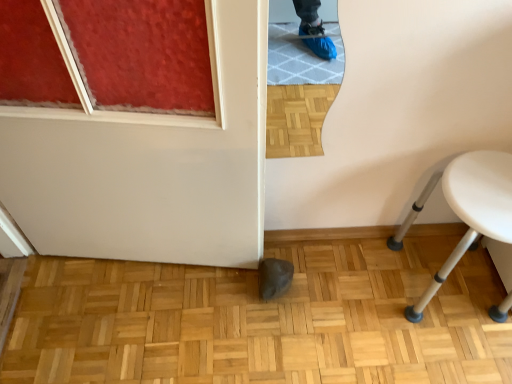
Identify the location of natural wood parquet floor at center. This screenshot has height=384, width=512. (262, 320).

At what (x,y) coordinates should I click in order to perform the action: click on white plastic stool at lower right. Please return your answer as a coordinate pair (x, y). The image size is (512, 384). Looking at the image, I should click on (473, 209).

Does white plastic stool at lower right have a greater width compared to white glossy door at lower center?

Indeed, white plastic stool at lower right has a greater width compared to white glossy door at lower center.

Considering the positions of objects white plastic stool at lower right and white glossy door at lower center in the image provided, who is more to the left, white plastic stool at lower right or white glossy door at lower center?

Positioned to the left is white glossy door at lower center.

Is point (455, 167) positioned before point (250, 11)?

No.

Is white plastic stool at lower right not close to white glossy door at lower center?

No, white plastic stool at lower right is not far away from white glossy door at lower center.

Considering the positions of point (53, 309) and point (57, 151), is point (53, 309) closer or farther from the camera than point (57, 151)?

Point (53, 309) is positioned farther from the camera compared to point (57, 151).

Based on the photo, can you tell me how much natural wood parquet floor at center and white glossy door at lower center differ in facing direction?

The angular difference between natural wood parquet floor at center and white glossy door at lower center is 98.7 degrees.

From the picture: Is natural wood parquet floor at center shorter than white glossy door at lower center?

Yes.

Is natural wood parquet floor at center spatially inside white glossy door at lower center, or outside of it?

natural wood parquet floor at center is not inside white glossy door at lower center, it's outside.

Can you tell me how much white glossy door at lower center and white plastic stool at lower right differ in facing direction?

They differ by 8.71 degrees in their facing directions.

Locate an element on the screen. This screenshot has width=512, height=384. furniture behind the white glossy door at lower center is located at coordinates [473, 209].

Consider the image. Is white glossy door at lower center in contact with white plastic stool at lower right?

No, white glossy door at lower center is not making contact with white plastic stool at lower right.

In the scene shown: From the image's perspective, is natural wood parquet floor at center on white plastic stool at lower right?

No, from the image's perspective, natural wood parquet floor at center is not above white plastic stool at lower right.

Is natural wood parquet floor at center oriented away from white plastic stool at lower right?

No.

Is natural wood parquet floor at center to the left or to the right of white plastic stool at lower right in the image?

natural wood parquet floor at center is positioned on white plastic stool at lower right's left side.

Looking at their sizes, would you say natural wood parquet floor at center is wider or thinner than white plastic stool at lower right?

In the image, natural wood parquet floor at center appears to be wider than white plastic stool at lower right.

Could you tell me if white glossy door at lower center is turned towards natural wood parquet floor at center?

Yes, white glossy door at lower center is turned towards natural wood parquet floor at center.

Between white glossy door at lower center and natural wood parquet floor at center, which one has smaller width?

Thinner between the two is white glossy door at lower center.

Looking at this image, is white glossy door at lower center next to natural wood parquet floor at center?

There is a gap between white glossy door at lower center and natural wood parquet floor at center.

From the image's perspective, is white glossy door at lower center over natural wood parquet floor at center?

Correct, white glossy door at lower center appears higher than natural wood parquet floor at center in the image.

Considering the positions of points (464, 176) and (23, 334), is point (464, 176) farther from camera compared to point (23, 334)?

No, it is not.

From a real-world perspective, is white plastic stool at lower right physically located above or below natural wood parquet floor at center?

From a real-world perspective, white plastic stool at lower right is physically above natural wood parquet floor at center.

In the image, is white plastic stool at lower right on the left side or the right side of natural wood parquet floor at center?

white plastic stool at lower right is to the right of natural wood parquet floor at center.

Are white plastic stool at lower right and natural wood parquet floor at center far apart?

Actually, white plastic stool at lower right and natural wood parquet floor at center are a little close together.

Where is `door on the left of white plastic stool at lower right`? door on the left of white plastic stool at lower right is located at coordinates (151, 166).

Identify the location of door above the natural wood parquet floor at center (from the image's perspective). This screenshot has height=384, width=512. (151, 166).

Considering their positions, is white plastic stool at lower right positioned closer to white glossy door at lower center than natural wood parquet floor at center?

The object closer to white glossy door at lower center is natural wood parquet floor at center.

Based on their spatial positions, is white plastic stool at lower right or white glossy door at lower center closer to natural wood parquet floor at center?

Among the two, white glossy door at lower center is located nearer to natural wood parquet floor at center.

Estimate the real-world distances between objects in this image. Which object is further from natural wood parquet floor at center, white glossy door at lower center or white plastic stool at lower right?

white plastic stool at lower right is positioned further to the anchor natural wood parquet floor at center.

From the image, which object appears to be nearer to white plastic stool at lower right, white glossy door at lower center or natural wood parquet floor at center?

natural wood parquet floor at center.

From the image, which object appears to be farther from white glossy door at lower center, natural wood parquet floor at center or white plastic stool at lower right?

white plastic stool at lower right.

Estimate the real-world distances between objects in this image. Which object is further from white plastic stool at lower right, natural wood parquet floor at center or white glossy door at lower center?

Among the two, white glossy door at lower center is located further to white plastic stool at lower right.

Find the location of a particular element. This screenshot has width=512, height=384. hardwood between white glossy door at lower center and white plastic stool at lower right is located at coordinates (262, 320).